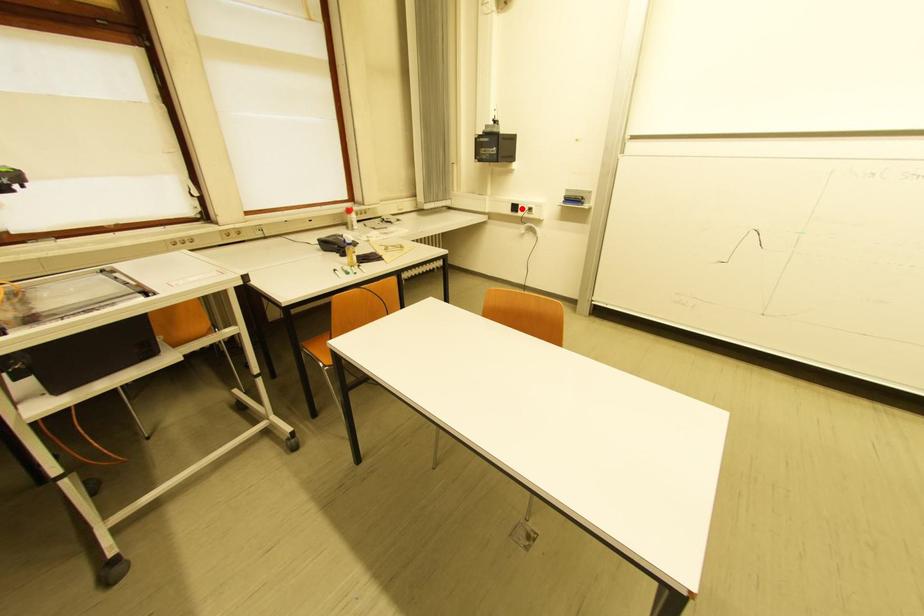
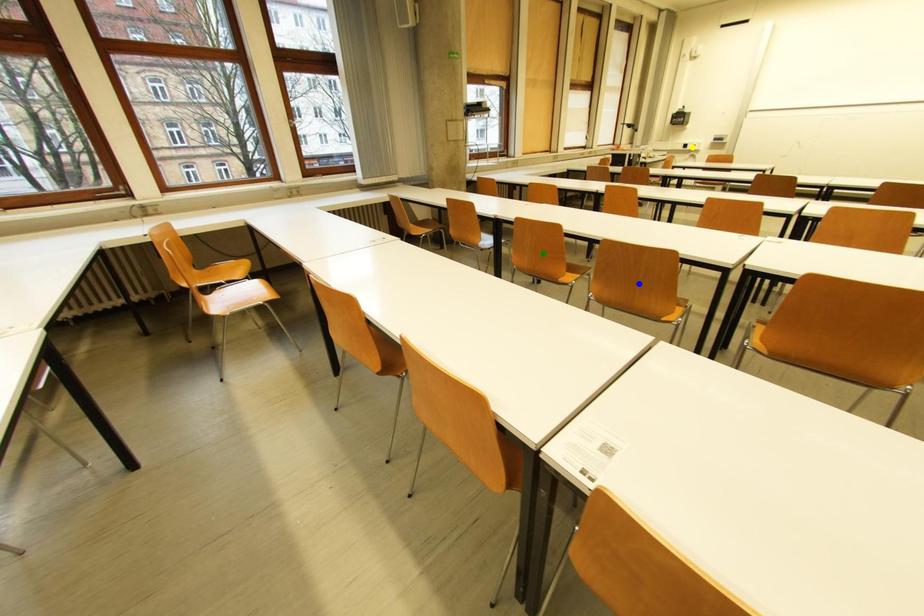
Question: I am providing you with two images of the same scene from different viewpoints. A red point is marked on the first image. You are given multiple points on the second image. Can you choose the point in image 2 that corresponds to the point in image 1?

Choices:
 (A) blue point
 (B) green point
 (C) yellow point

Answer: (C)